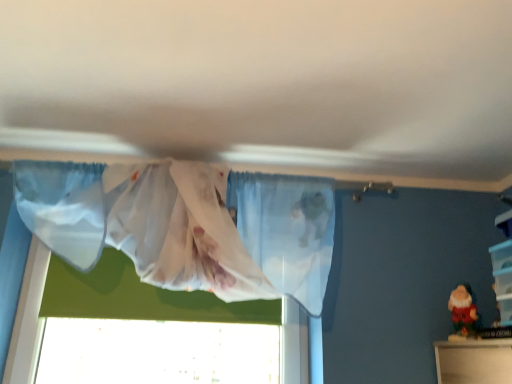
In order to click on matte plastic santa at lower right in this screenshot , I will do `click(464, 311)`.

What is the approximate width of matte plastic santa at lower right?

The width of matte plastic santa at lower right is 3.15 inches.

Locate an element on the screen. translucent fabric curtain at upper center is located at coordinates (189, 226).

Is point (142, 224) in front of point (465, 329)?

Yes.

Based on their sizes in the image, would you say translucent fabric curtain at upper center is bigger or smaller than matte plastic santa at lower right?

Considering their sizes, translucent fabric curtain at upper center takes up more space than matte plastic santa at lower right.

Is translucent fabric curtain at upper center facing towards matte plastic santa at lower right?

No, translucent fabric curtain at upper center is not oriented towards matte plastic santa at lower right.

Who is taller, translucent fabric curtain at upper center or matte plastic santa at lower right?

translucent fabric curtain at upper center.

Is matte plastic santa at lower right not close to clear plastic storage at right?

matte plastic santa at lower right is near clear plastic storage at right, not far away.

Can you confirm if matte plastic santa at lower right is smaller than clear plastic storage at right?

Indeed, matte plastic santa at lower right has a smaller size compared to clear plastic storage at right.

Which is closer, (459, 326) or (499, 265)?

Point (459, 326) appears to be farther away from the viewer than point (499, 265).

Is translucent fabric curtain at upper center to the left or to the right of clear plastic storage at right in the image?

translucent fabric curtain at upper center is to the left of clear plastic storage at right.

Which of these two, translucent fabric curtain at upper center or clear plastic storage at right, is smaller?

With smaller size is clear plastic storage at right.

From the image's perspective, is translucent fabric curtain at upper center above or below clear plastic storage at right?

Based on their image positions, translucent fabric curtain at upper center is located above clear plastic storage at right.

Is clear plastic storage at right outside of matte plastic santa at lower right?

clear plastic storage at right lies outside matte plastic santa at lower right's area.

Is clear plastic storage at right shorter than matte plastic santa at lower right?

→ In fact, clear plastic storage at right may be taller than matte plastic santa at lower right.

Is point (495, 271) more distant than point (470, 300)?

No, (495, 271) is in front of (470, 300).

Is clear plastic storage at right facing away from matte plastic santa at lower right?

No, matte plastic santa at lower right is not at the back of clear plastic storage at right.

Considering the sizes of objects matte plastic santa at lower right and translucent fabric curtain at upper center in the image provided, who is smaller, matte plastic santa at lower right or translucent fabric curtain at upper center?

Smaller between the two is matte plastic santa at lower right.

In the scene shown: Relative to translucent fabric curtain at upper center, is matte plastic santa at lower right in front or behind?

Clearly, matte plastic santa at lower right is behind translucent fabric curtain at upper center.

In the scene shown: Considering the sizes of matte plastic santa at lower right and translucent fabric curtain at upper center in the image, is matte plastic santa at lower right taller or shorter than translucent fabric curtain at upper center?

Considering their sizes, matte plastic santa at lower right has less height than translucent fabric curtain at upper center.

From the picture: Is matte plastic santa at lower right at the left side of translucent fabric curtain at upper center?

No, matte plastic santa at lower right is not to the left of translucent fabric curtain at upper center.

Does clear plastic storage at right appear on the right side of translucent fabric curtain at upper center?

Yes, clear plastic storage at right is to the right of translucent fabric curtain at upper center.

From the image's perspective, is clear plastic storage at right located beneath translucent fabric curtain at upper center?

Yes.

Is clear plastic storage at right oriented towards translucent fabric curtain at upper center?

Yes, clear plastic storage at right faces towards translucent fabric curtain at upper center.

Is clear plastic storage at right far from translucent fabric curtain at upper center?

clear plastic storage at right is actually quite close to translucent fabric curtain at upper center.

The image size is (512, 384). I want to click on curtain lying on the left of matte plastic santa at lower right, so click(189, 226).

Where is `shelf in front of the matte plastic santa at lower right`? The height and width of the screenshot is (384, 512). shelf in front of the matte plastic santa at lower right is located at coordinates (503, 268).

Consider the image. From the image, which object appears to be farther from matte plastic santa at lower right, translucent fabric curtain at upper center or clear plastic storage at right?

translucent fabric curtain at upper center is positioned further to the anchor matte plastic santa at lower right.

Which object lies further to the anchor point translucent fabric curtain at upper center, matte plastic santa at lower right or clear plastic storage at right?

clear plastic storage at right.

Looking at the image, which one is located further to clear plastic storage at right, matte plastic santa at lower right or translucent fabric curtain at upper center?

Based on the image, translucent fabric curtain at upper center appears to be further to clear plastic storage at right.

Estimate the real-world distances between objects in this image. Which object is further from translucent fabric curtain at upper center, clear plastic storage at right or matte plastic santa at lower right?

clear plastic storage at right lies further to translucent fabric curtain at upper center than the other object.

Which object lies nearer to the anchor point matte plastic santa at lower right, clear plastic storage at right or translucent fabric curtain at upper center?

clear plastic storage at right lies closer to matte plastic santa at lower right than the other object.

Which object lies nearer to the anchor point clear plastic storage at right, translucent fabric curtain at upper center or matte plastic santa at lower right?

matte plastic santa at lower right is closer to clear plastic storage at right.

Find the location of a particular element. This screenshot has width=512, height=384. toy between translucent fabric curtain at upper center and clear plastic storage at right from left to right is located at coordinates (464, 311).